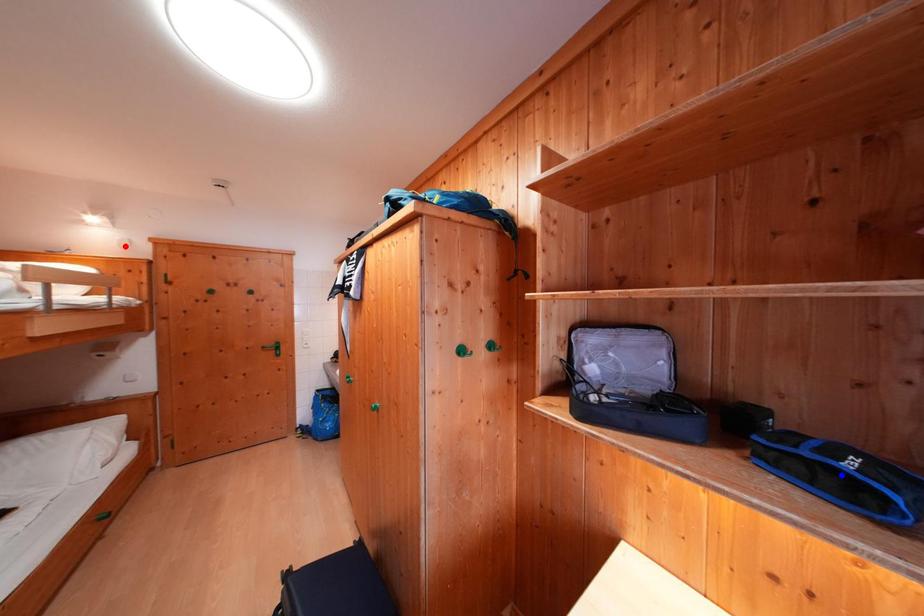
Question: In the image, two points are highlighted. Which point is nearer to the camera? Reply with the corresponding letter.

Choices:
 (A) blue point
 (B) red point

Answer: (A)